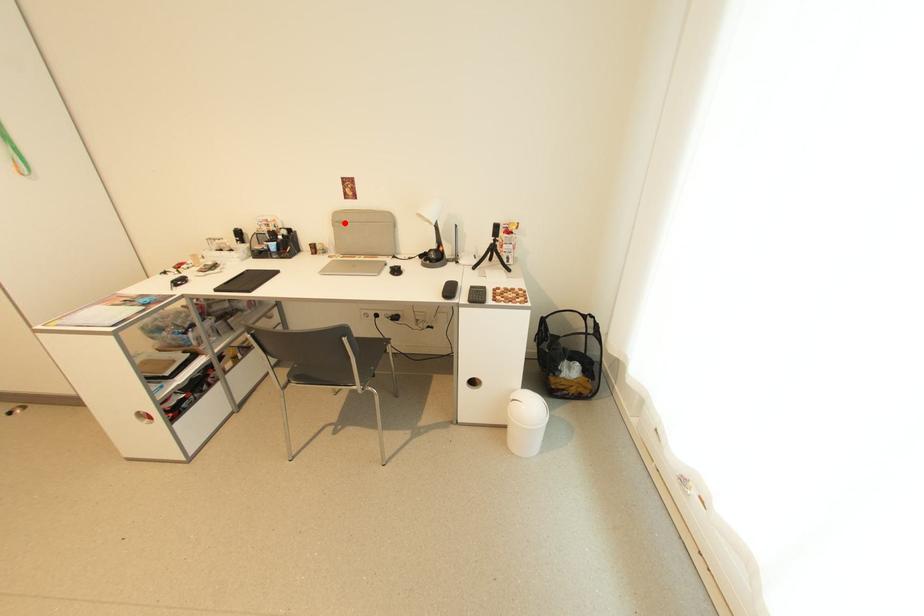
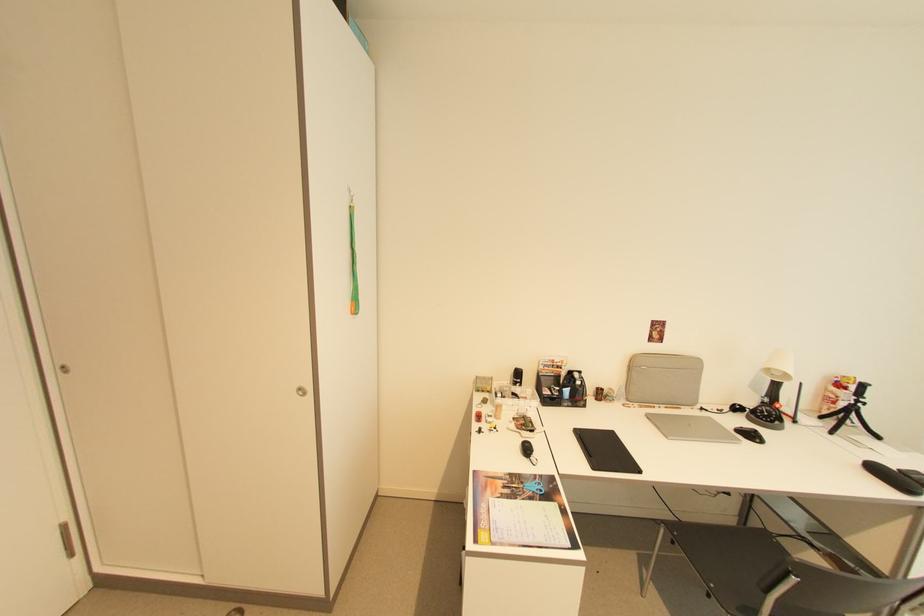
Question: I am providing you with two images of the same scene from different viewpoints. In image1, a red point is highlighted. Considering the same 3D point in image2, which of the following is correct?

Choices:
 (A) It is closer
 (B) It is farther

Answer: (B)